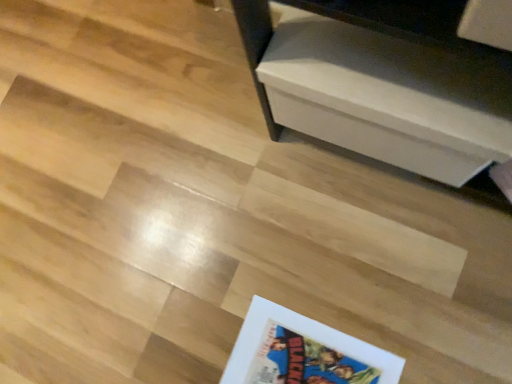
Where is `white fabric ottoman at upper right`? This screenshot has height=384, width=512. white fabric ottoman at upper right is located at coordinates (377, 92).

The height and width of the screenshot is (384, 512). What do you see at coordinates (377, 92) in the screenshot?
I see `white fabric ottoman at upper right` at bounding box center [377, 92].

What is the approximate height of white fabric ottoman at upper right?

The height of white fabric ottoman at upper right is 7.94 inches.

This screenshot has width=512, height=384. I want to click on white fabric ottoman at upper right, so click(x=377, y=92).